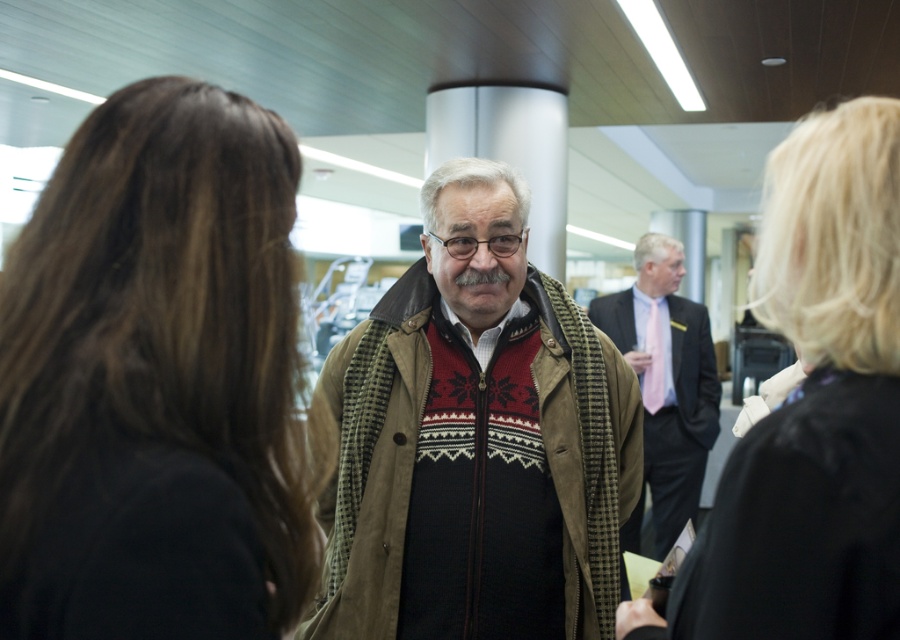
The man in the image is wearing a knit sweater at center. If you were to draw a dot at point (x=477, y=442) on the image, where would it be located?

The point (x=477, y=442) corresponds to the knit sweater at center, so the dot would be placed there.

You are a fashion designer observing the man in the image. You notice the knit sweater at center and the black leather jacket at right. Which clothing item is positioned lower on his body?

The knit sweater at center is positioned lower on his body than the black leather jacket at right because it is described as being below it.